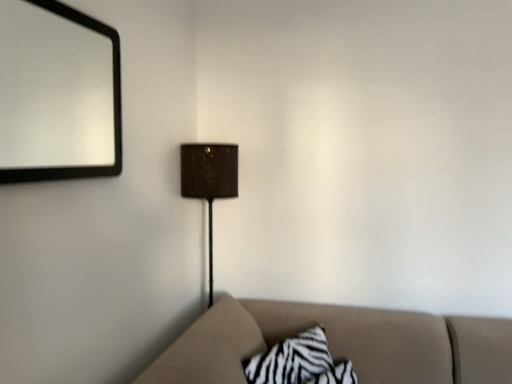
Question: Is black matte mirror at upper left to the left of matte brown lampshade at center from the viewer's perspective?

Choices:
 (A) no
 (B) yes

Answer: (B)

Question: Can you confirm if black matte mirror at upper left is taller than matte brown lampshade at center?

Choices:
 (A) yes
 (B) no

Answer: (B)

Question: Is black matte mirror at upper left wider than matte brown lampshade at center?

Choices:
 (A) yes
 (B) no

Answer: (B)

Question: Considering the relative sizes of black matte mirror at upper left and matte brown lampshade at center in the image provided, is black matte mirror at upper left thinner than matte brown lampshade at center?

Choices:
 (A) yes
 (B) no

Answer: (A)

Question: From a real-world perspective, is black matte mirror at upper left physically below matte brown lampshade at center?

Choices:
 (A) yes
 (B) no

Answer: (B)

Question: Based on their positions, is zebra-patterned fabric pillow at lower center located to the left or right of matte brown lampshade at center?

Choices:
 (A) right
 (B) left

Answer: (A)

Question: In the image, is zebra-patterned fabric pillow at lower center positioned in front of or behind matte brown lampshade at center?

Choices:
 (A) front
 (B) behind

Answer: (A)

Question: From a real-world perspective, is zebra-patterned fabric pillow at lower center physically located above or below matte brown lampshade at center?

Choices:
 (A) below
 (B) above

Answer: (A)

Question: Is zebra-patterned fabric pillow at lower center spatially inside matte brown lampshade at center, or outside of it?

Choices:
 (A) outside
 (B) inside

Answer: (A)

Question: Is matte brown lampshade at center taller or shorter than zebra-patterned fabric pillow at lower center?

Choices:
 (A) tall
 (B) short

Answer: (A)

Question: Considering the positions of point (211, 168) and point (304, 339), is point (211, 168) closer or farther from the camera than point (304, 339)?

Choices:
 (A) closer
 (B) farther

Answer: (B)

Question: Based on their sizes in the image, would you say matte brown lampshade at center is bigger or smaller than zebra-patterned fabric pillow at lower center?

Choices:
 (A) small
 (B) big

Answer: (B)

Question: From the image's perspective, is matte brown lampshade at center above or below zebra-patterned fabric pillow at lower center?

Choices:
 (A) above
 (B) below

Answer: (A)

Question: Is point click(x=273, y=365) positioned closer to the camera than point click(x=70, y=145)?

Choices:
 (A) farther
 (B) closer

Answer: (B)

Question: From the image's perspective, is zebra-patterned fabric pillow at lower center located above or below black matte mirror at upper left?

Choices:
 (A) below
 (B) above

Answer: (A)